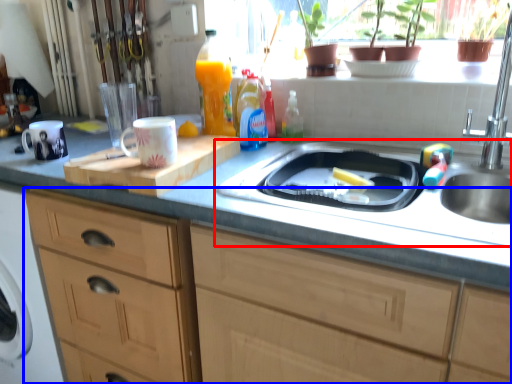
Question: Among these objects, which one is farthest to the camera, sink (highlighted by a red box) or cabinetry (highlighted by a blue box)?

Choices:
 (A) sink
 (B) cabinetry

Answer: (A)